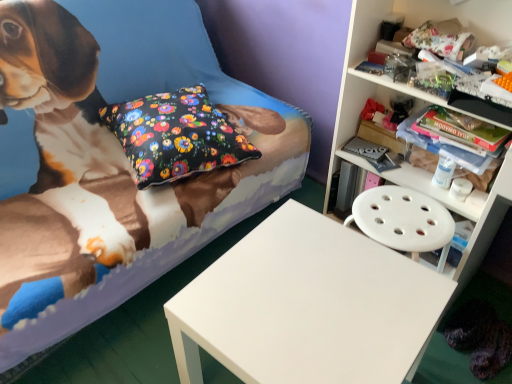
Question: Considering the relative sizes of white matte table at center and white plastic shelf at upper right in the image provided, is white matte table at center wider than white plastic shelf at upper right?

Choices:
 (A) no
 (B) yes

Answer: (B)

Question: From a real-world perspective, is white matte table at center beneath white plastic shelf at upper right?

Choices:
 (A) yes
 (B) no

Answer: (A)

Question: Is white matte table at center oriented towards white plastic shelf at upper right?

Choices:
 (A) no
 (B) yes

Answer: (A)

Question: Is white matte table at center taller than white plastic shelf at upper right?

Choices:
 (A) yes
 (B) no

Answer: (B)

Question: Is white matte table at center further to the viewer compared to white plastic shelf at upper right?

Choices:
 (A) no
 (B) yes

Answer: (A)

Question: Is fluffy fabric bed at center inside or outside of white matte table at center?

Choices:
 (A) outside
 (B) inside

Answer: (A)

Question: In terms of width, does fluffy fabric bed at center look wider or thinner when compared to white matte table at center?

Choices:
 (A) thin
 (B) wide

Answer: (B)

Question: Based on their positions, is fluffy fabric bed at center located to the left or right of white matte table at center?

Choices:
 (A) left
 (B) right

Answer: (A)

Question: From the image's perspective, relative to white matte table at center, is fluffy fabric bed at center above or below?

Choices:
 (A) below
 (B) above

Answer: (B)

Question: Relative to fluffy fabric bed at center, is floral fabric pillow at center in front or behind?

Choices:
 (A) behind
 (B) front

Answer: (A)

Question: Is floral fabric pillow at center taller or shorter than fluffy fabric bed at center?

Choices:
 (A) tall
 (B) short

Answer: (B)

Question: From a real-world perspective, is floral fabric pillow at center physically located above or below fluffy fabric bed at center?

Choices:
 (A) above
 (B) below

Answer: (A)

Question: Is floral fabric pillow at center bigger or smaller than fluffy fabric bed at center?

Choices:
 (A) small
 (B) big

Answer: (A)

Question: Based on their sizes in the image, would you say white plastic shelf at upper right is bigger or smaller than fluffy fabric bed at center?

Choices:
 (A) small
 (B) big

Answer: (A)

Question: From a real-world perspective, is white plastic shelf at upper right above or below fluffy fabric bed at center?

Choices:
 (A) above
 (B) below

Answer: (A)